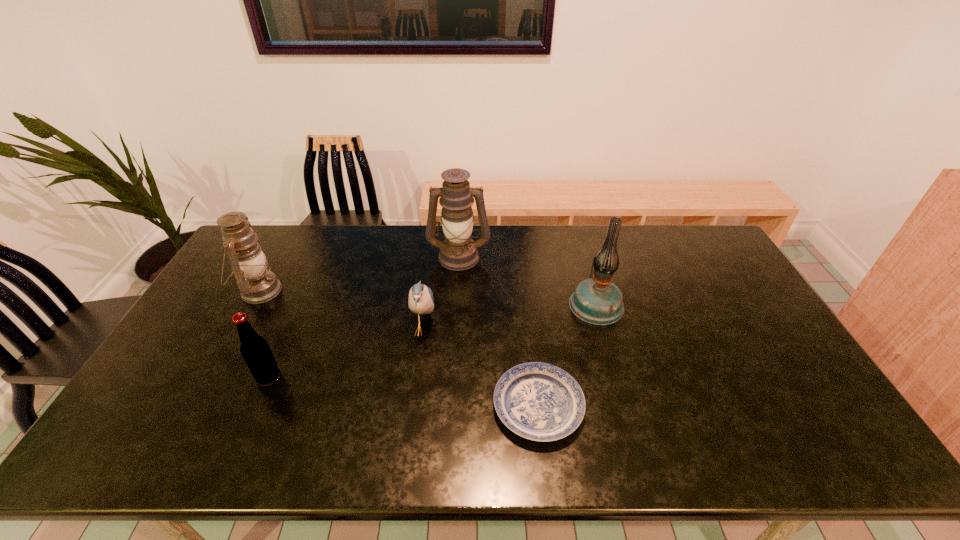
I want to click on object identified as the closest to the rightmost object, so click(x=538, y=401).

The height and width of the screenshot is (540, 960). I want to click on object that can be found as the third closest to the farthest oil lamp, so click(538, 401).

The width and height of the screenshot is (960, 540). Find the location of `the closest oil lamp relative to the leftmost object`. the closest oil lamp relative to the leftmost object is located at coordinates (458, 252).

Point out which oil lamp is positioned as the third nearest to the plate. Please provide its 2D coordinates. Your answer should be formatted as a tuple, i.e. [(x, y)], where the tuple contains the x and y coordinates of a point satisfying the conditions above.

[(249, 261)]

I want to click on vacant point that satisfies the following two spatial constraints: 1. on the back side of the plate; 2. on the right side of the rightmost object, so click(527, 304).

Find the location of `vacant region that satisfies the following two spatial constraints: 1. on the back side of the fourth tallest object; 2. on the left side of the rightmost oil lamp`. vacant region that satisfies the following two spatial constraints: 1. on the back side of the fourth tallest object; 2. on the left side of the rightmost oil lamp is located at coordinates (300, 304).

Where is `vacant region that satisfies the following two spatial constraints: 1. at the tip of the plate's beak; 2. on the left side of the bird`? The height and width of the screenshot is (540, 960). vacant region that satisfies the following two spatial constraints: 1. at the tip of the plate's beak; 2. on the left side of the bird is located at coordinates (414, 406).

Locate an element on the screen. free location that satisfies the following two spatial constraints: 1. on the front side of the farthest object; 2. at the tip of the bird's beak is located at coordinates (455, 329).

This screenshot has height=540, width=960. In order to click on free location that satisfies the following two spatial constraints: 1. on the front side of the farthest oil lamp; 2. at the tip of the bird's beak in this screenshot , I will do `click(455, 329)`.